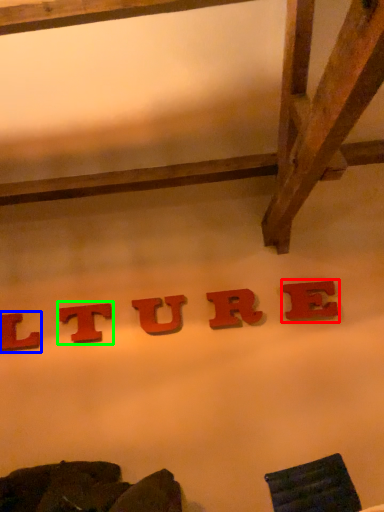
Question: Which object is the closest to the letter (highlighted by a red box)? Choose among these: letter (highlighted by a blue box) or letter (highlighted by a green box).

Choices:
 (A) letter
 (B) letter

Answer: (B)